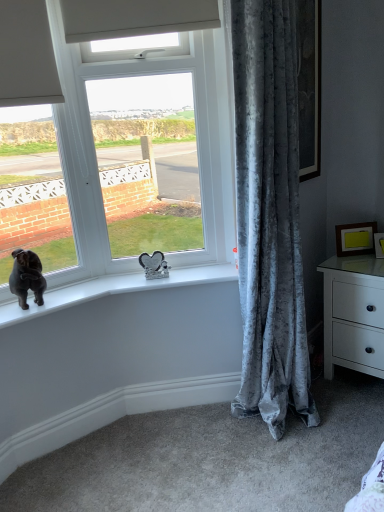
Question: Is the depth of white plastic window at center greater than that of white glossy chest of drawers at right?

Choices:
 (A) no
 (B) yes

Answer: (A)

Question: Can you confirm if white plastic window at center is positioned to the right of white glossy chest of drawers at right?

Choices:
 (A) no
 (B) yes

Answer: (A)

Question: Is white glossy chest of drawers at right at the back of white plastic window at center?

Choices:
 (A) no
 (B) yes

Answer: (A)

Question: Does white plastic window at center have a lesser height compared to white glossy chest of drawers at right?

Choices:
 (A) yes
 (B) no

Answer: (B)

Question: Can you confirm if white plastic window at center is positioned to the left of white glossy chest of drawers at right?

Choices:
 (A) yes
 (B) no

Answer: (A)

Question: Is velvet gray curtain at right wider or thinner than black velvet dog at window?

Choices:
 (A) thin
 (B) wide

Answer: (B)

Question: Would you say velvet gray curtain at right is to the left or to the right of black velvet dog at window in the picture?

Choices:
 (A) right
 (B) left

Answer: (A)

Question: From their relative heights in the image, would you say velvet gray curtain at right is taller or shorter than black velvet dog at window?

Choices:
 (A) short
 (B) tall

Answer: (B)

Question: Would you say velvet gray curtain at right is inside or outside black velvet dog at window?

Choices:
 (A) outside
 (B) inside

Answer: (A)

Question: Is matte gold picture frame at right, the first picture frame from the right, in front of or behind black velvet dog at window in the image?

Choices:
 (A) front
 (B) behind

Answer: (B)

Question: In the image, is matte gold picture frame at right, which is the second picture frame in left-to-right order, on the left side or the right side of black velvet dog at window?

Choices:
 (A) right
 (B) left

Answer: (A)

Question: Considering the positions of point (382, 237) and point (18, 296), is point (382, 237) closer or farther from the camera than point (18, 296)?

Choices:
 (A) closer
 (B) farther

Answer: (B)

Question: Looking at the image, does matte gold picture frame at right, which is the second picture frame in left-to-right order, seem bigger or smaller compared to black velvet dog at window?

Choices:
 (A) small
 (B) big

Answer: (A)

Question: In terms of height, does white plastic window at center look taller or shorter compared to velvet gray curtain at right?

Choices:
 (A) tall
 (B) short

Answer: (B)

Question: Relative to velvet gray curtain at right, is white plastic window at center in front or behind?

Choices:
 (A) front
 (B) behind

Answer: (B)